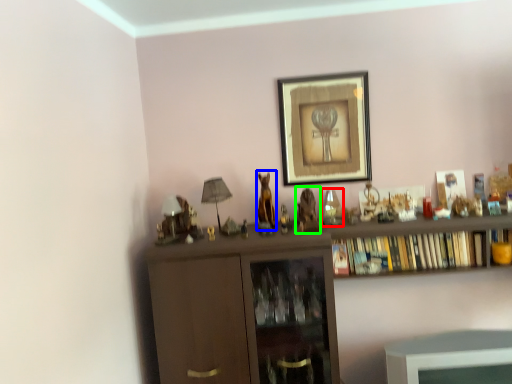
Question: Estimate the real-world distances between objects in this image. Which object is closer to toy (highlighted by a red box), animal (highlighted by a blue box) or animal (highlighted by a green box)?

Choices:
 (A) animal
 (B) animal

Answer: (B)